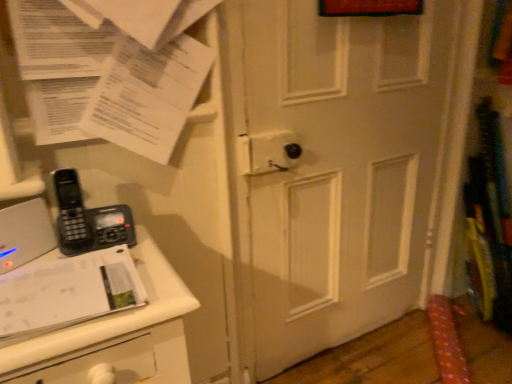
At what (x,y) coordinates should I click in order to perform the action: click on free space above white plastic changing table at left (from a real-world perspective). Please return your answer as a coordinate pair (x, y). Looking at the image, I should click on (87, 286).